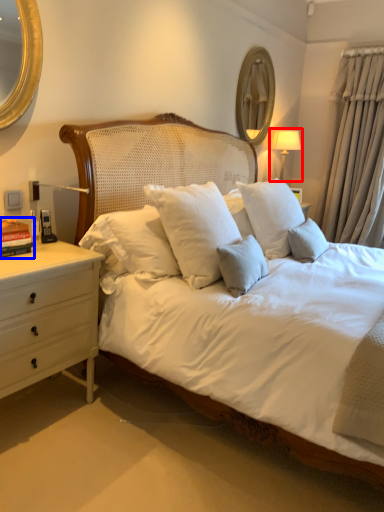
Question: Which object is further to the camera taking this photo, bedside lamp (highlighted by a red box) or book (highlighted by a blue box)?

Choices:
 (A) bedside lamp
 (B) book

Answer: (A)